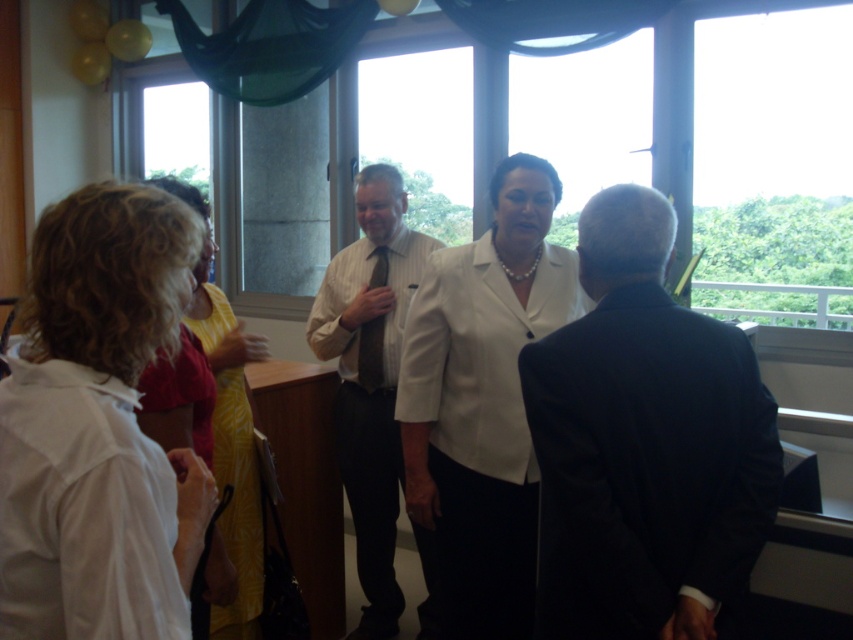
Is transparent glass window at center positioned in front of white matte blazer at center?

No, transparent glass window at center is behind white matte blazer at center.

Based on the photo, is transparent glass window at center smaller than white matte blazer at center?

No.

This screenshot has height=640, width=853. I want to click on transparent glass window at center, so click(711, 106).

Measure the distance from white matte blazer at center to transparent glass window at upper right.

5.55 feet

Does white matte blazer at center have a smaller size compared to transparent glass window at upper right?

Correct, white matte blazer at center occupies less space than transparent glass window at upper right.

Is point (444, 285) positioned behind point (821, 22)?

No.

Where is `white matte blazer at center`? white matte blazer at center is located at coordinates (483, 403).

Is white matte blazer at center to the right of white striped shirt at center from the viewer's perspective?

Indeed, white matte blazer at center is positioned on the right side of white striped shirt at center.

Can you confirm if white matte blazer at center is taller than white striped shirt at center?

No, white matte blazer at center is not taller than white striped shirt at center.

This screenshot has height=640, width=853. Identify the location of white matte blazer at center. (483, 403).

You are a GUI agent. You are given a task and a screenshot of the screen. Output one action in this format:
    pyautogui.click(x=<x>, y=<y>)
    Task: Click on the white matte blazer at center
    
    Given the screenshot: What is the action you would take?
    pyautogui.click(x=483, y=403)